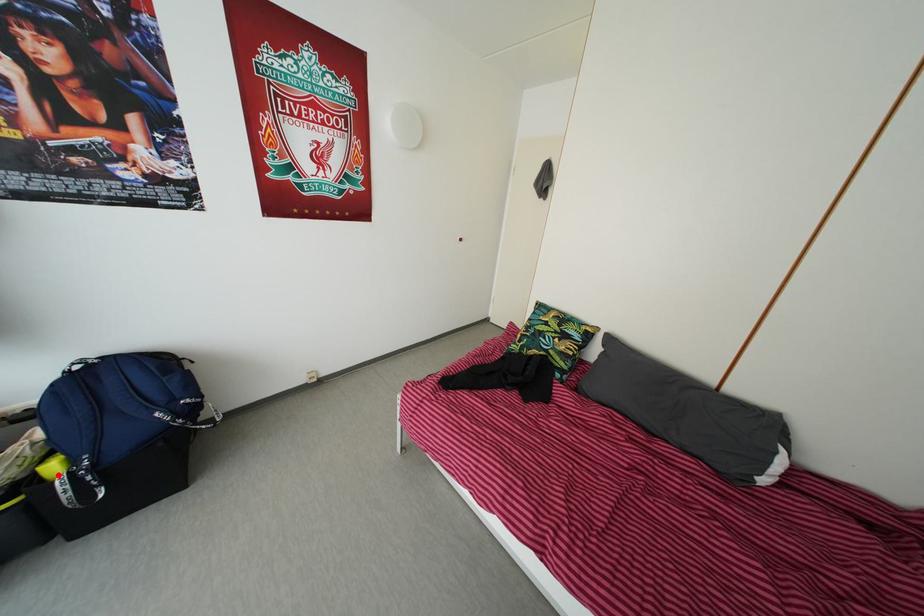
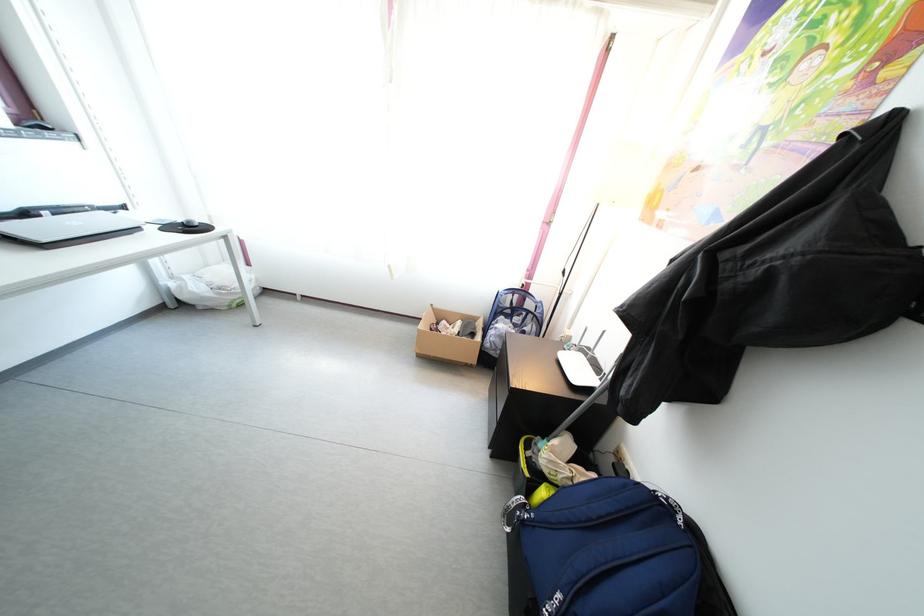
Where in the second image is the point corresponding to the highlighted location from the first image?

(550, 501)